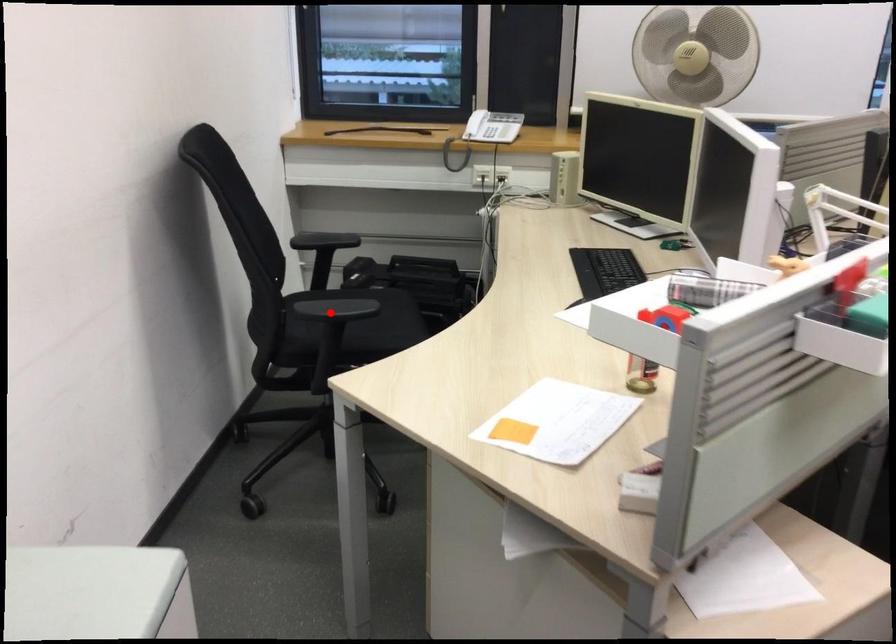
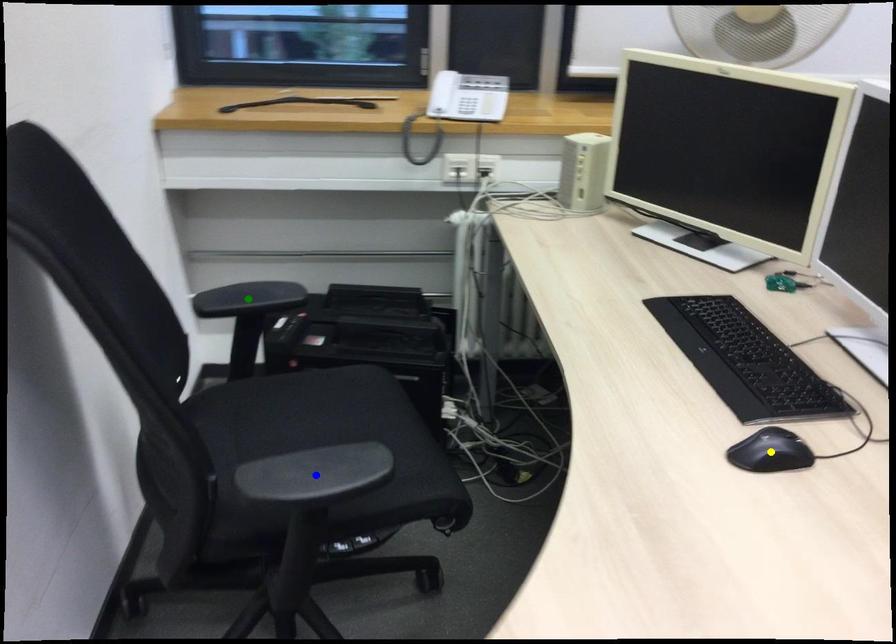
Question: I am providing you with two images of the same scene from different viewpoints. A red point is marked on the first image. You are given multiple points on the second image. Which point in image 2 is actually the same real-world point as the red point in image 1?

Choices:
 (A) blue point
 (B) green point
 (C) yellow point

Answer: (A)